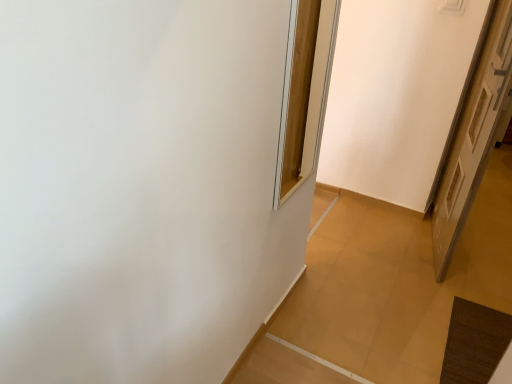
What do you see at coordinates (474, 137) in the screenshot? I see `white wooden door at right` at bounding box center [474, 137].

Identify the location of white wooden door at right. (474, 137).

The image size is (512, 384). What are the coordinates of `wooden frame at upper center` in the screenshot? It's located at (307, 99).

Describe the element at coordinates (307, 99) in the screenshot. I see `wooden frame at upper center` at that location.

Locate an element on the screen. Image resolution: width=512 pixels, height=384 pixels. white wooden door at right is located at coordinates (474, 137).

Between white wooden door at right and wooden frame at upper center, which one appears on the left side from the viewer's perspective?

wooden frame at upper center is more to the left.

In the image, is white wooden door at right positioned in front of or behind wooden frame at upper center?

Visually, white wooden door at right is located behind wooden frame at upper center.

Which is nearer, (497, 47) or (303, 143)?

Point (497, 47) is closer to the camera than point (303, 143).

From the image's perspective, is white wooden door at right above wooden frame at upper center?

Incorrect, from the image's perspective, white wooden door at right is lower than wooden frame at upper center.

From a real-world perspective, is white wooden door at right under wooden frame at upper center?

Correct, in the physical world, white wooden door at right is lower than wooden frame at upper center.

Is white wooden door at right wider or thinner than wooden frame at upper center?

Clearly, white wooden door at right has more width compared to wooden frame at upper center.

Does white wooden door at right have a lesser height compared to wooden frame at upper center?

No, white wooden door at right is not shorter than wooden frame at upper center.

Is white wooden door at right bigger or smaller than wooden frame at upper center?

Clearly, white wooden door at right is larger in size than wooden frame at upper center.

Is white wooden door at right spatially inside wooden frame at upper center, or outside of it?

white wooden door at right is not inside wooden frame at upper center, it's outside.

Is white wooden door at right in contact with wooden frame at upper center?

No, white wooden door at right is not beside wooden frame at upper center.

Is white wooden door at right oriented towards wooden frame at upper center?

No, white wooden door at right is not turned towards wooden frame at upper center.

At what (x,y) coordinates should I click in order to perform the action: click on door on the right of wooden frame at upper center. Please return your answer as a coordinate pair (x, y). The height and width of the screenshot is (384, 512). Looking at the image, I should click on (474, 137).

Which is more to the left, wooden frame at upper center or white wooden door at right?

wooden frame at upper center is more to the left.

Relative to white wooden door at right, is wooden frame at upper center in front or behind?

wooden frame at upper center is positioned closer to the viewer than white wooden door at right.

Which is less distant, (308, 150) or (499, 119)?

Point (308, 150).

From the image's perspective, between wooden frame at upper center and white wooden door at right, which one is located above?

wooden frame at upper center.

From a real-world perspective, is wooden frame at upper center under white wooden door at right?

No, from a real-world perspective, wooden frame at upper center is not beneath white wooden door at right.

Can you confirm if wooden frame at upper center is wider than white wooden door at right?

In fact, wooden frame at upper center might be narrower than white wooden door at right.

Considering the sizes of objects wooden frame at upper center and white wooden door at right in the image provided, who is taller, wooden frame at upper center or white wooden door at right?

Answer: white wooden door at right is taller.

Based on their sizes in the image, would you say wooden frame at upper center is bigger or smaller than white wooden door at right?

Considering their sizes, wooden frame at upper center takes up less space than white wooden door at right.

Would you say wooden frame at upper center is inside or outside white wooden door at right?

wooden frame at upper center cannot be found inside white wooden door at right.

Is wooden frame at upper center beside white wooden door at right?

No, wooden frame at upper center is not in contact with white wooden door at right.

Is wooden frame at upper center aimed at white wooden door at right?

No, wooden frame at upper center is not facing towards white wooden door at right.

How different are the orientations of wooden frame at upper center and white wooden door at right in degrees?

The facing directions of wooden frame at upper center and white wooden door at right are 10.9 degrees apart.

Locate an element on the screen. door located on the right of wooden frame at upper center is located at coordinates (474, 137).

The width and height of the screenshot is (512, 384). Find the location of `door located on the right of wooden frame at upper center`. door located on the right of wooden frame at upper center is located at coordinates point(474,137).

Identify the location of door below the wooden frame at upper center (from the image's perspective). Image resolution: width=512 pixels, height=384 pixels. (474, 137).